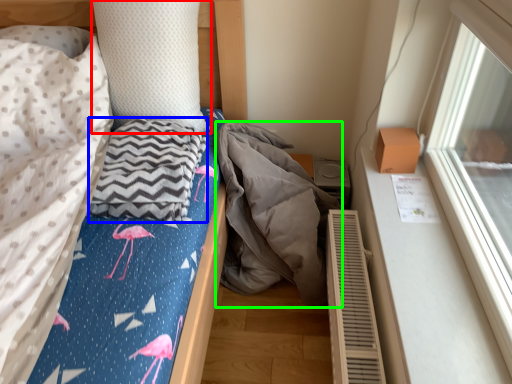
Question: Which object is the farthest from pillow (highlighted by a red box)? Choose among these: material (highlighted by a blue box) or material (highlighted by a green box).

Choices:
 (A) material
 (B) material

Answer: (B)